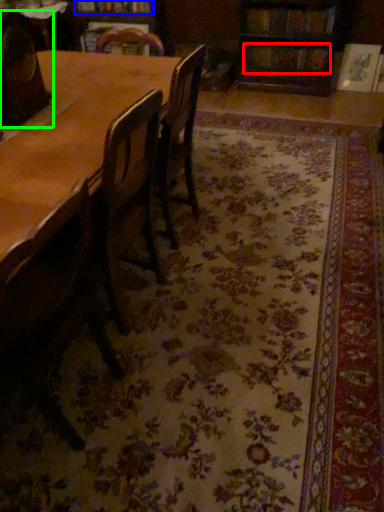
Question: Which object is the closest to the book (highlighted by a red box)? Choose among these: book (highlighted by a blue box) or chair (highlighted by a green box).

Choices:
 (A) book
 (B) chair

Answer: (A)